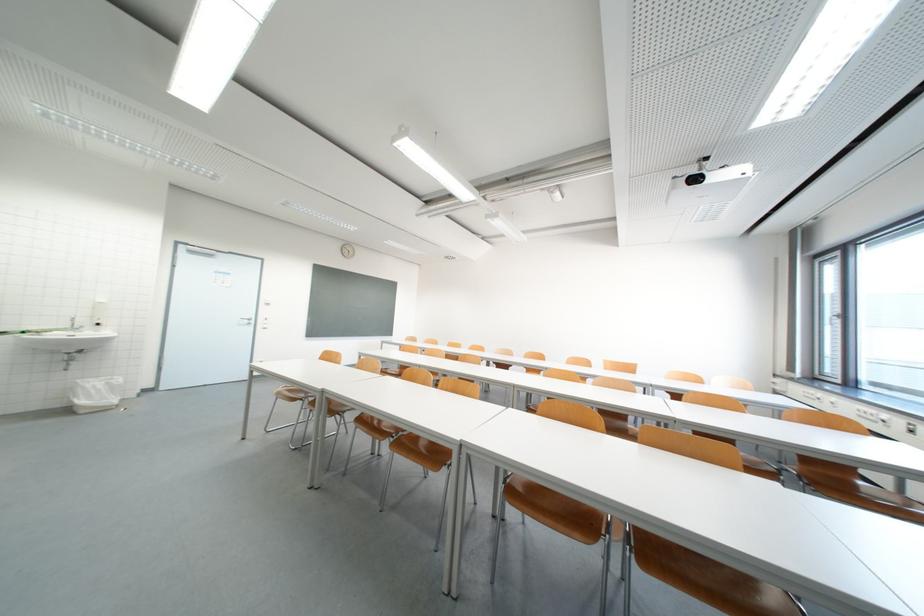
At what (x,y) coordinates should I click in order to perform the action: click on silver door handle. Please return your answer as a coordinate pair (x, y). The height and width of the screenshot is (616, 924). Looking at the image, I should click on (245, 321).